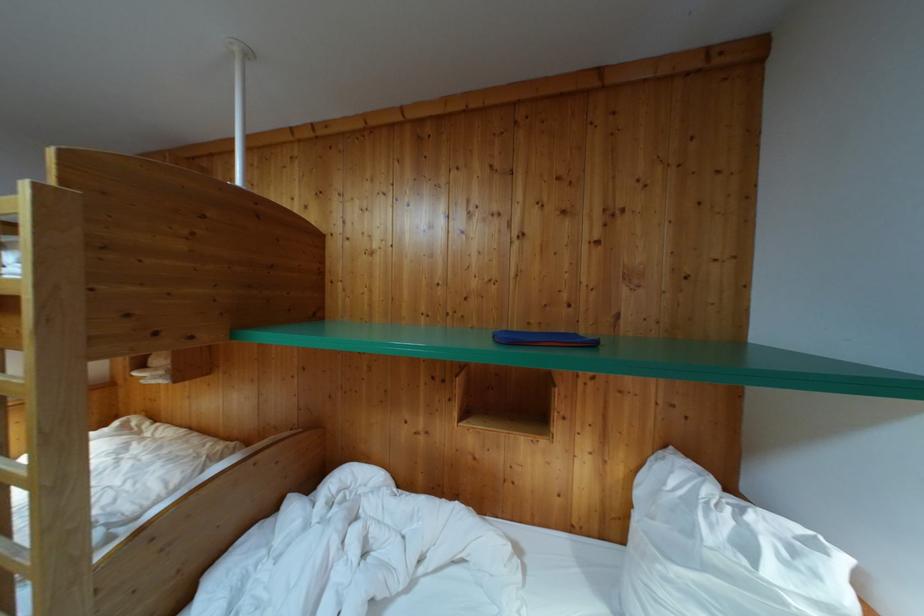
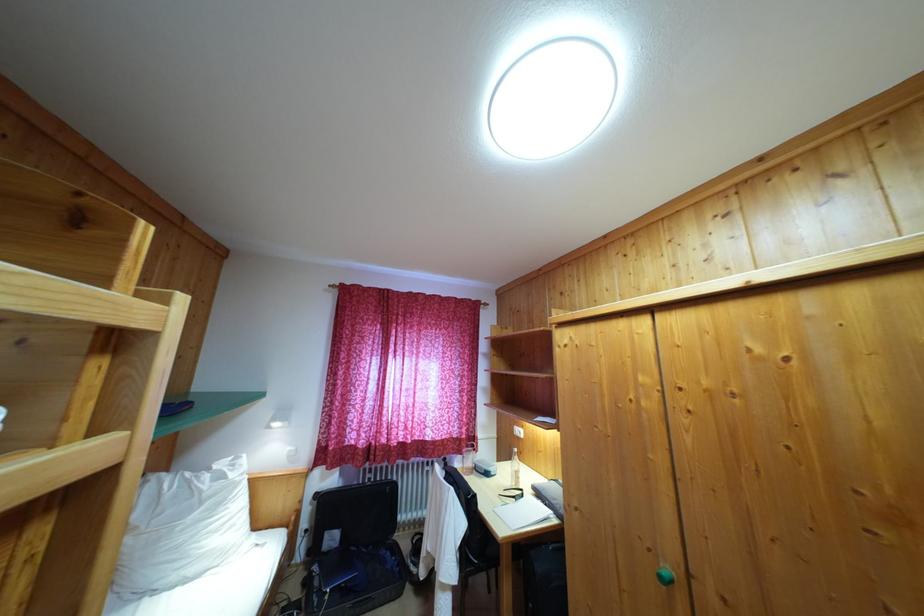
The point at (746, 517) is marked in the first image. Where is the corresponding point in the second image?

(213, 476)